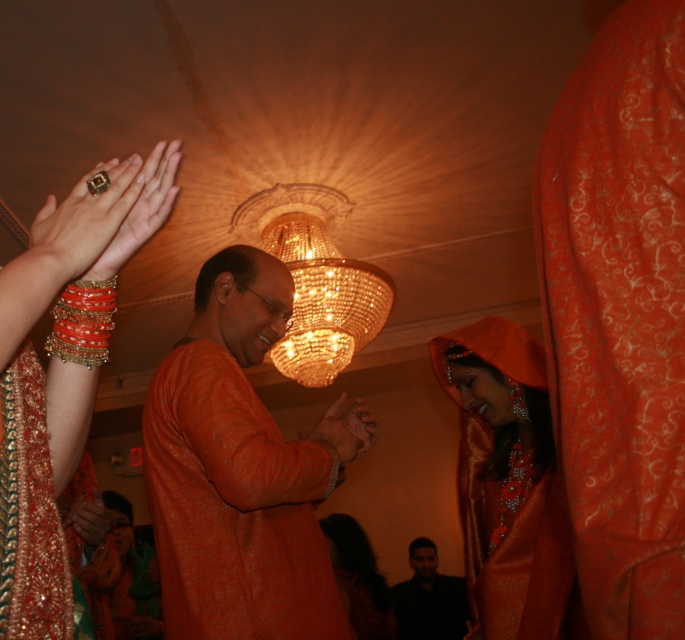
Is gold textured ring at upper left thinner than matte orange hand at center?

In fact, gold textured ring at upper left might be wider than matte orange hand at center.

Is gold textured ring at upper left wider than matte orange hand at center?

Yes.

Describe the element at coordinates (86, 218) in the screenshot. This screenshot has width=685, height=640. I see `gold textured ring at upper left` at that location.

Locate an element on the screen. The width and height of the screenshot is (685, 640). gold textured ring at upper left is located at coordinates (86, 218).

Between point (49, 202) and point (86, 305), which one is positioned behind?

Positioned behind is point (49, 202).

Does point (73, 204) come in front of point (51, 342)?

Yes, it is.

The image size is (685, 640). In order to click on gold textured ring at upper left in this screenshot , I will do coord(86,218).

Can you confirm if black matte shirt at lower center is thinner than matte orange hand at center?

Incorrect, black matte shirt at lower center's width is not less than matte orange hand at center's.

Is black matte shirt at lower center taller than matte orange hand at center?

Correct, black matte shirt at lower center is much taller as matte orange hand at center.

What do you see at coordinates (427, 598) in the screenshot? The image size is (685, 640). I see `black matte shirt at lower center` at bounding box center [427, 598].

Locate an element on the screen. black matte shirt at lower center is located at coordinates (427, 598).